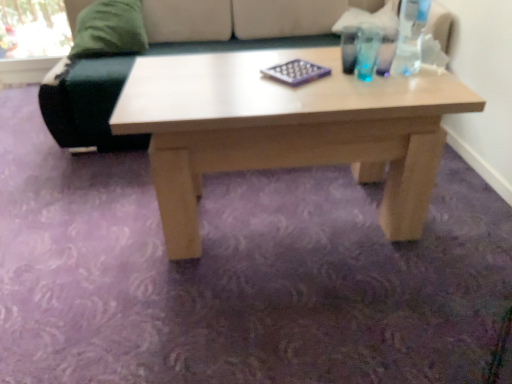
Question: Considering the relative sizes of transparent plastic bottle at upper right and velvet green couch at upper left in the image provided, is transparent plastic bottle at upper right shorter than velvet green couch at upper left?

Choices:
 (A) yes
 (B) no

Answer: (A)

Question: Is velvet green couch at upper left surrounded by transparent plastic bottle at upper right?

Choices:
 (A) no
 (B) yes

Answer: (A)

Question: From the image's perspective, would you say transparent plastic bottle at upper right is shown under velvet green couch at upper left?

Choices:
 (A) yes
 (B) no

Answer: (A)

Question: Considering the relative positions of transparent plastic bottle at upper right and velvet green couch at upper left in the image provided, is transparent plastic bottle at upper right behind velvet green couch at upper left?

Choices:
 (A) yes
 (B) no

Answer: (B)

Question: Is transparent plastic bottle at upper right in front of velvet green couch at upper left?

Choices:
 (A) yes
 (B) no

Answer: (A)

Question: Considering their positions, is velvet green couch at upper left located in front of or behind purple matte chessboard at center?

Choices:
 (A) front
 (B) behind

Answer: (B)

Question: Considering the positions of point (179, 51) and point (270, 69), is point (179, 51) closer or farther from the camera than point (270, 69)?

Choices:
 (A) farther
 (B) closer

Answer: (A)

Question: Visually, is velvet green couch at upper left positioned to the left or to the right of purple matte chessboard at center?

Choices:
 (A) left
 (B) right

Answer: (A)

Question: From a real-world perspective, is velvet green couch at upper left above or below purple matte chessboard at center?

Choices:
 (A) above
 (B) below

Answer: (B)

Question: From a real-world perspective, relative to velvet green couch at upper left, is transparent plastic bottle at upper right vertically above or below?

Choices:
 (A) below
 (B) above

Answer: (B)

Question: Visually, is transparent plastic bottle at upper right positioned to the left or to the right of velvet green couch at upper left?

Choices:
 (A) right
 (B) left

Answer: (A)

Question: Looking at their shapes, would you say transparent plastic bottle at upper right is wider or thinner than velvet green couch at upper left?

Choices:
 (A) wide
 (B) thin

Answer: (B)

Question: Based on their sizes in the image, would you say transparent plastic bottle at upper right is bigger or smaller than velvet green couch at upper left?

Choices:
 (A) big
 (B) small

Answer: (B)

Question: Which is correct: green fabric pillow at upper left is inside purple matte chessboard at center, or outside of it?

Choices:
 (A) outside
 (B) inside

Answer: (A)

Question: Considering their positions, is green fabric pillow at upper left located in front of or behind purple matte chessboard at center?

Choices:
 (A) behind
 (B) front

Answer: (A)